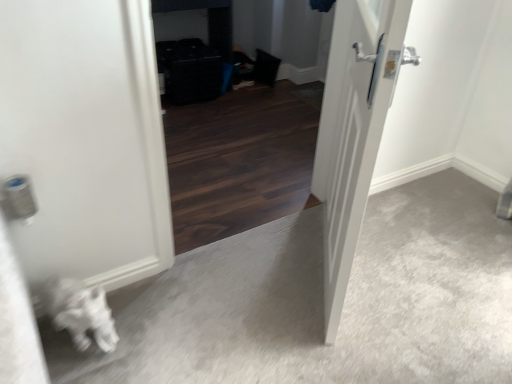
Question: Should I look upward or downward to see white glossy door at center?

Choices:
 (A) up
 (B) down

Answer: (A)